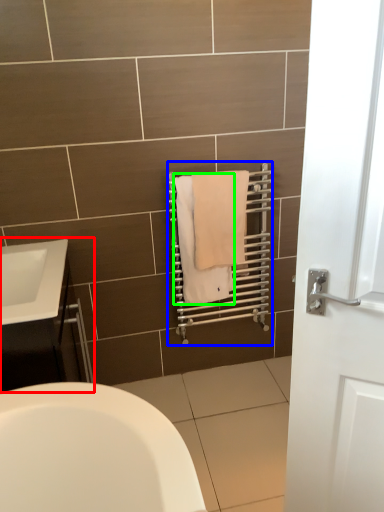
Question: Considering the real-world distances, which object is farthest from bathroom cabinet (highlighted by a red box)? balustrade (highlighted by a blue box) or bath towel (highlighted by a green box)?

Choices:
 (A) balustrade
 (B) bath towel

Answer: (A)